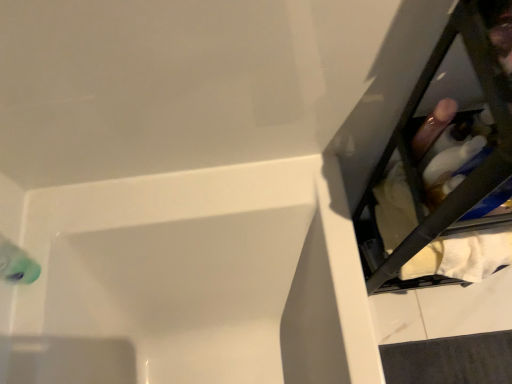
Question: From the image's perspective, would you say white fabric at right is shown under white glossy bathtub at lower left?

Choices:
 (A) yes
 (B) no

Answer: (B)

Question: Is the surface of white fabric at right in direct contact with white glossy bathtub at lower left?

Choices:
 (A) no
 (B) yes

Answer: (A)

Question: Considering the relative sizes of white fabric at right and white glossy bathtub at lower left in the image provided, is white fabric at right wider than white glossy bathtub at lower left?

Choices:
 (A) yes
 (B) no

Answer: (B)

Question: Does white fabric at right appear on the left side of white glossy bathtub at lower left?

Choices:
 (A) yes
 (B) no

Answer: (B)

Question: Considering the relative sizes of white fabric at right and white glossy bathtub at lower left in the image provided, is white fabric at right bigger than white glossy bathtub at lower left?

Choices:
 (A) no
 (B) yes

Answer: (A)

Question: From a real-world perspective, does white fabric at right stand above white glossy bathtub at lower left?

Choices:
 (A) no
 (B) yes

Answer: (B)

Question: Is white glossy bathtub at lower left at the left side of white fabric at right?

Choices:
 (A) no
 (B) yes

Answer: (B)

Question: Is white glossy bathtub at lower left behind white fabric at right?

Choices:
 (A) yes
 (B) no

Answer: (A)

Question: From the image's perspective, is white glossy bathtub at lower left on top of white fabric at right?

Choices:
 (A) yes
 (B) no

Answer: (B)

Question: Considering the relative sizes of white glossy bathtub at lower left and white fabric at right in the image provided, is white glossy bathtub at lower left smaller than white fabric at right?

Choices:
 (A) no
 (B) yes

Answer: (A)

Question: Can you confirm if white glossy bathtub at lower left is positioned to the right of white fabric at right?

Choices:
 (A) yes
 (B) no

Answer: (B)

Question: Does white glossy bathtub at lower left have a greater height compared to white fabric at right?

Choices:
 (A) yes
 (B) no

Answer: (B)

Question: Visually, is white fabric at right positioned to the left or to the right of white glossy bathtub at lower left?

Choices:
 (A) right
 (B) left

Answer: (A)